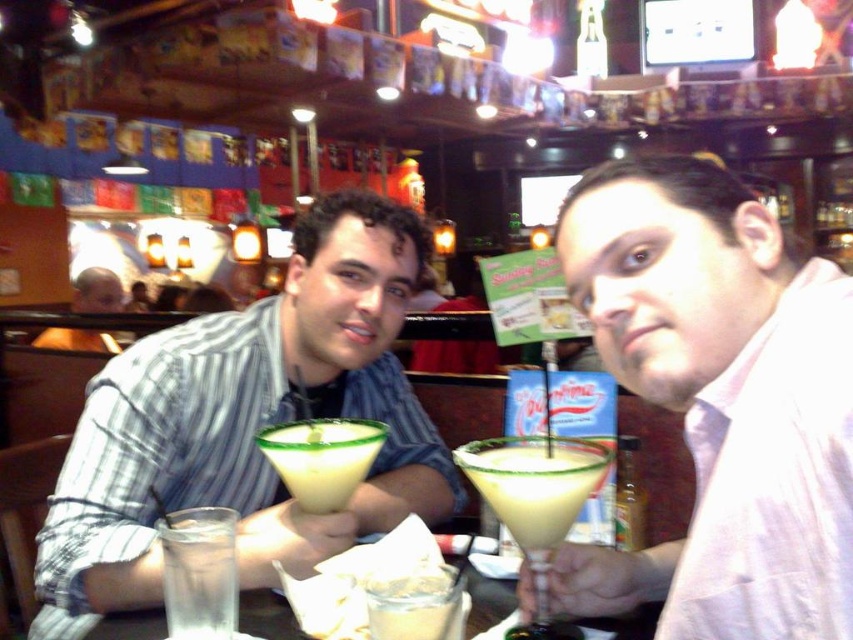
You are a waiter at the bar and need to place a new drink order on the table. The new drink is the same size as the clear glass at lower center. Where should you place it to avoid covering the matte pink shirt at center?

The matte pink shirt at center is larger in size than the clear glass at lower center, so you should place the new drink in an area of the table not occupied by the matte pink shirt at center to ensure it doesn not cover it.